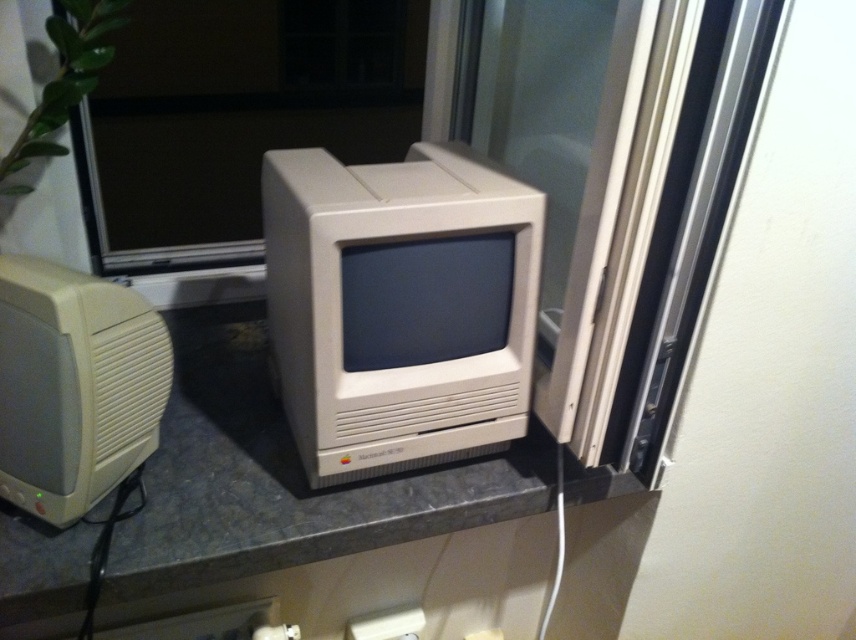
Question: Does white plastic computer monitor at center appear over matte gray countertop at center?

Choices:
 (A) yes
 (B) no

Answer: (A)

Question: Which object is farther from the camera taking this photo?

Choices:
 (A) white plastic electric outlet at lower center
 (B) white plastic computer monitor at center
 (C) matte gray countertop at center
 (D) beige plastic desktop computer at left

Answer: (A)

Question: Which point appears closest to the camera in this image?

Choices:
 (A) (135, 342)
 (B) (302, 150)
 (C) (395, 508)

Answer: (A)

Question: Does white plastic computer monitor at center lie behind beige plastic desktop computer at left?

Choices:
 (A) yes
 (B) no

Answer: (A)

Question: Is matte gray countertop at center above white plastic electric outlet at lower center?

Choices:
 (A) no
 (B) yes

Answer: (B)

Question: Which of the following is the farthest from the observer?

Choices:
 (A) (308, 547)
 (B) (389, 618)
 (C) (363, 432)

Answer: (B)